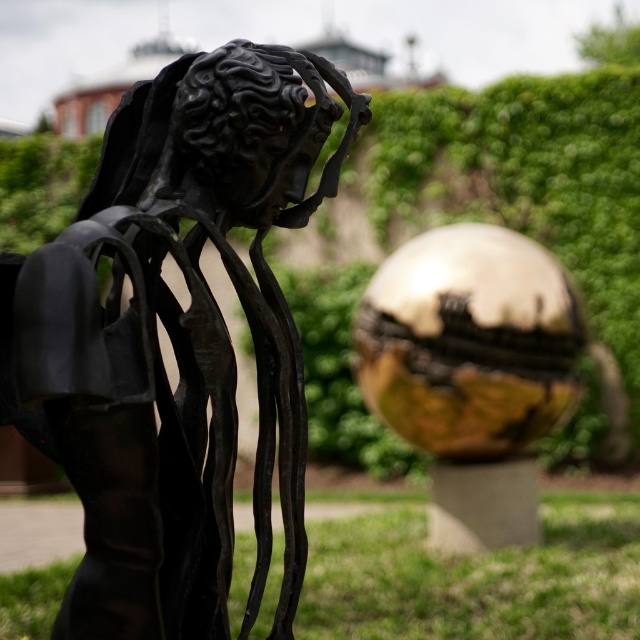
You are standing in front of the dark metallic sculpture. There is a specific point at coordinates point [140,268] that you need to reach with your hand. Can you estimate whether this point is within arm reach? Assume your arm can extend up to 2.5 feet.

The distance of point [140,268] from camera is 6.18 feet, so it is beyond your arm reach of 2.5 feet.

Based on the photo, you are an art curator planning to install a new light fixture at point [173,340]. The current installation at that point is the black matte sculpture at left. Can you confirm if the light fixture can be placed there without removing the sculpture?

The point [173,340] is occupied by the black matte sculpture at left, so the light fixture cannot be placed there without removing the sculpture.

You are a gardener who needs to trim both the green leafy hedge at upper center and the green grass at lower right. Which of these two will require more time to trim due to its size?

The green leafy hedge at upper center will require more time to trim because it is bigger than the green grass at lower right.